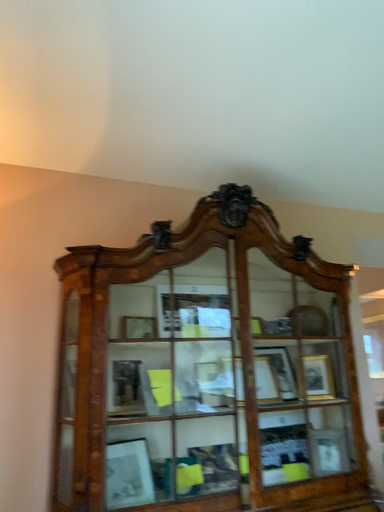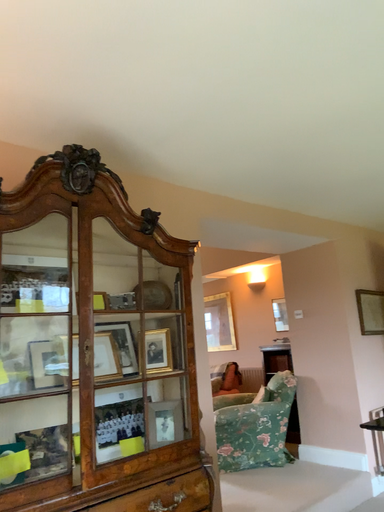
Question: Which way did the camera rotate in the video?

Choices:
 (A) rotated right
 (B) rotated left

Answer: (A)